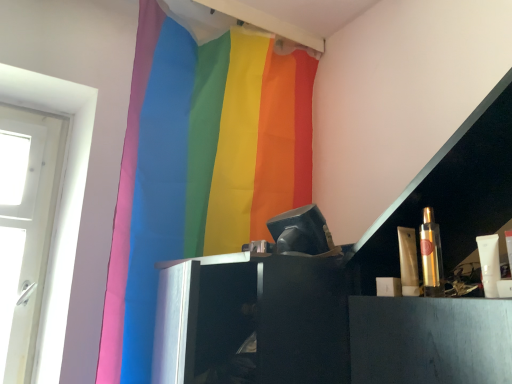
Question: From the image's perspective, is gold metallic spray can at right, placed as the 1th toiletry when sorted from right to left, above rainbow fabric curtain at upper center?

Choices:
 (A) yes
 (B) no

Answer: (B)

Question: Is gold metallic spray can at right, placed as the 1th toiletry when sorted from right to left, placed right next to rainbow fabric curtain at upper center?

Choices:
 (A) yes
 (B) no

Answer: (B)

Question: Does gold metallic spray can at right, positioned as the 2th toiletry in left-to-right order, have a greater height compared to rainbow fabric curtain at upper center?

Choices:
 (A) no
 (B) yes

Answer: (A)

Question: Considering the relative positions of gold metallic spray can at right, placed as the 1th toiletry when sorted from right to left, and rainbow fabric curtain at upper center in the image provided, is gold metallic spray can at right, placed as the 1th toiletry when sorted from right to left, to the right of rainbow fabric curtain at upper center from the viewer's perspective?

Choices:
 (A) yes
 (B) no

Answer: (A)

Question: From a real-world perspective, is gold metallic spray can at right, positioned as the 2th toiletry in left-to-right order, under rainbow fabric curtain at upper center?

Choices:
 (A) no
 (B) yes

Answer: (B)

Question: Is point coord(185,225) positioned closer to the camera than point coord(439,258)?

Choices:
 (A) farther
 (B) closer

Answer: (A)

Question: Choose the correct answer: Is rainbow fabric curtain at upper center inside gold metallic spray can at right, placed as the 1th toiletry when sorted from right to left, or outside it?

Choices:
 (A) outside
 (B) inside

Answer: (A)

Question: Is rainbow fabric curtain at upper center bigger or smaller than gold metallic spray can at right, positioned as the 2th toiletry in left-to-right order?

Choices:
 (A) small
 (B) big

Answer: (B)

Question: Based on their positions, is rainbow fabric curtain at upper center located to the left or right of gold metallic spray can at right, positioned as the 2th toiletry in left-to-right order?

Choices:
 (A) right
 (B) left

Answer: (B)

Question: From the image's perspective, relative to rainbow fabric curtain at upper center, is gold metallic spray can at right, positioned as the 2th toiletry in left-to-right order, above or below?

Choices:
 (A) above
 (B) below

Answer: (B)

Question: Considering the positions of gold metallic spray can at right, positioned as the 2th toiletry in left-to-right order, and rainbow fabric curtain at upper center in the image, is gold metallic spray can at right, positioned as the 2th toiletry in left-to-right order, taller or shorter than rainbow fabric curtain at upper center?

Choices:
 (A) tall
 (B) short

Answer: (B)

Question: Is gold metallic spray can at right, placed as the 1th toiletry when sorted from right to left, inside the boundaries of rainbow fabric curtain at upper center, or outside?

Choices:
 (A) inside
 (B) outside

Answer: (B)

Question: Considering the positions of point (435, 271) and point (121, 344), is point (435, 271) closer or farther from the camera than point (121, 344)?

Choices:
 (A) closer
 (B) farther

Answer: (A)

Question: From the image's perspective, is shiny gold tube at right, which is the 2th toiletry from right to left, located above or below rainbow fabric curtain at upper center?

Choices:
 (A) below
 (B) above

Answer: (A)

Question: Based on their positions, is shiny gold tube at right, which is the 2th toiletry from right to left, located to the left or right of rainbow fabric curtain at upper center?

Choices:
 (A) right
 (B) left

Answer: (A)